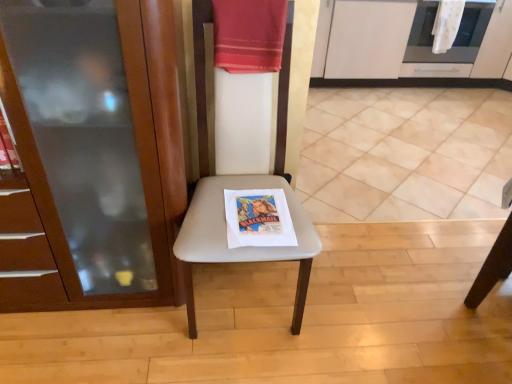
Question: Is beige fabric chair at center wider or thinner than white textured towel at upper right, the second beach towel in the left-to-right sequence?

Choices:
 (A) wide
 (B) thin

Answer: (A)

Question: Looking at the image, does beige fabric chair at center seem bigger or smaller compared to white textured towel at upper right, the second beach towel from the front?

Choices:
 (A) big
 (B) small

Answer: (A)

Question: Estimate the real-world distances between objects in this image. Which object is farther from the stainless steel oven at upper right?

Choices:
 (A) white matte cabinet at upper right, which ranks as the 1th cabinetry in back-to-front order
 (B) matte wood cabinet at left, the second cabinetry in the right-to-left sequence
 (C) beige fabric chair at center
 (D) red cotton towel at upper center, which is the 1th beach towel in left-to-right order
 (E) white textured towel at upper right, the 1th beach towel in the right-to-left sequence

Answer: (B)

Question: Which of these objects is positioned farthest from the matte wood cabinet at left, which is the 1th cabinetry from front to back?

Choices:
 (A) stainless steel oven at upper right
 (B) white matte cabinet at upper right, marked as the 2th cabinetry in a left-to-right arrangement
 (C) white textured towel at upper right, the first beach towel from the top
 (D) red cotton towel at upper center, which is the 1th beach towel in left-to-right order
 (E) beige fabric chair at center

Answer: (C)